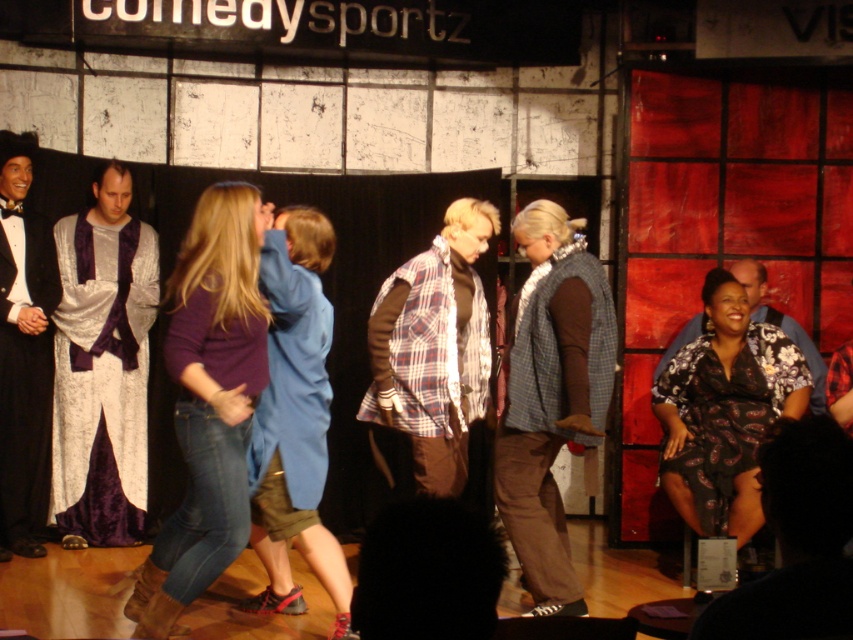
Is point (230, 536) farther from viewer compared to point (0, 278)?

No, (230, 536) is in front of (0, 278).

Image resolution: width=853 pixels, height=640 pixels. I want to click on matte purple sweater at center, so click(207, 401).

What are the coordinates of `matte purple sweater at center` in the screenshot? It's located at (207, 401).

Based on the photo, does velvet purple robe at left appear under floral-patterned dress at center?

Incorrect, velvet purple robe at left is not positioned below floral-patterned dress at center.

Does velvet purple robe at left appear over floral-patterned dress at center?

Indeed, velvet purple robe at left is positioned over floral-patterned dress at center.

Locate an element on the screen. velvet purple robe at left is located at coordinates (102, 368).

Who is lower down, velvet purple robe at left or floral fabric shirt at right?

velvet purple robe at left is lower down.

Locate an element on the screen. The height and width of the screenshot is (640, 853). velvet purple robe at left is located at coordinates (102, 368).

Locate an element on the screen. This screenshot has height=640, width=853. velvet purple robe at left is located at coordinates (102, 368).